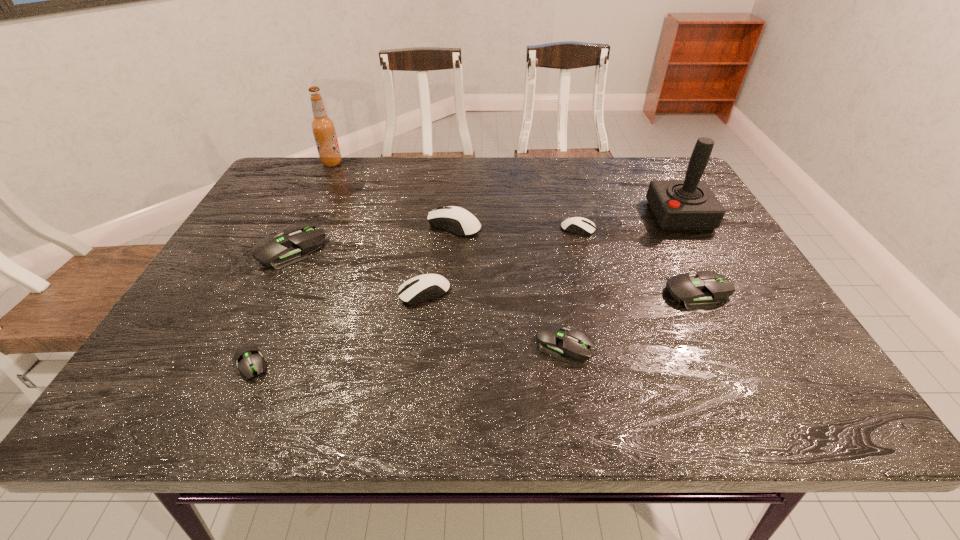
Locate which gray computer mouse ranks third in proximity to the biggest white mouse. Please provide its 2D coordinates. Your answer should be formatted as a tuple, i.e. [(x, y)], where the tuple contains the x and y coordinates of a point satisfying the conditions above.

[(696, 291)]

Select which gray computer mouse is the third closest to the third biggest gray computer mouse. Please provide its 2D coordinates. Your answer should be formatted as a tuple, i.e. [(x, y)], where the tuple contains the x and y coordinates of a point satisfying the conditions above.

[(295, 243)]

Where is `free space that satisfies the following two spatial constraints: 1. on the front label of the farthest object; 2. on the left side of the second biggest white mouse`? free space that satisfies the following two spatial constraints: 1. on the front label of the farthest object; 2. on the left side of the second biggest white mouse is located at coordinates (268, 293).

Identify the location of vacant space that satisfies the following two spatial constraints: 1. on the base of the red joystick; 2. on the front side of the smallest white mouse. This screenshot has width=960, height=540. (687, 230).

The height and width of the screenshot is (540, 960). I want to click on free point that satisfies the following two spatial constraints: 1. on the front label of the farthest object; 2. on the left side of the second gray computer mouse from right to left, so click(243, 343).

Where is `free spot that satisfies the following two spatial constraints: 1. on the front label of the third nearest gray computer mouse; 2. on the left side of the farthest object`? The height and width of the screenshot is (540, 960). free spot that satisfies the following two spatial constraints: 1. on the front label of the third nearest gray computer mouse; 2. on the left side of the farthest object is located at coordinates (268, 293).

This screenshot has height=540, width=960. I want to click on free space that satisfies the following two spatial constraints: 1. on the back side of the third nearest gray computer mouse; 2. on the front label of the beer bottle, so click(632, 163).

You are a GUI agent. You are given a task and a screenshot of the screen. Output one action in this format:
    pyautogui.click(x=<x>, y=<y>)
    Task: Click on the free spot that satisfies the following two spatial constraints: 1. on the front label of the third biggest gray computer mouse; 2. on the left side of the farthest object
    Image resolution: width=960 pixels, height=540 pixels.
    Given the screenshot: What is the action you would take?
    pyautogui.click(x=243, y=343)

Where is `free region that satisfies the following two spatial constraints: 1. on the back side of the smallest gray computer mouse; 2. on the right side of the smallest white mouse`? free region that satisfies the following two spatial constraints: 1. on the back side of the smallest gray computer mouse; 2. on the right side of the smallest white mouse is located at coordinates (312, 230).

In order to click on vacant point that satisfies the following two spatial constraints: 1. on the front label of the rightmost gray computer mouse; 2. on the right side of the farthest object in this screenshot , I will do `click(268, 293)`.